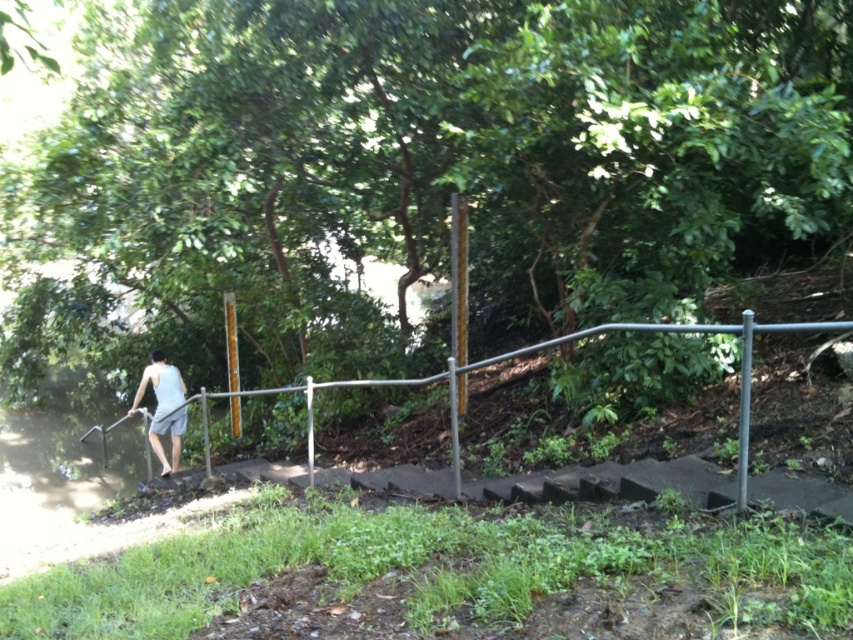
You are a painter standing at the bottom of the stone steps. You want to paint the silver metallic rail at center and the light gray tank top at left. How far apart are these two objects from your current position?

The silver metallic rail at center and the light gray tank top at left are 6.66 feet apart from each other.

You are a photographer trying to capture the light gray tank top at left through your camera lens. However, the silver metallic rail at center is blocking your view. Can you adjust your position to avoid the rail and still see the tank top?

Yes, since the silver metallic rail at center is in front of the light gray tank top at left, moving your camera position slightly to the side or adjusting the angle would allow you to see the light gray tank top at left without the rail blocking the view.